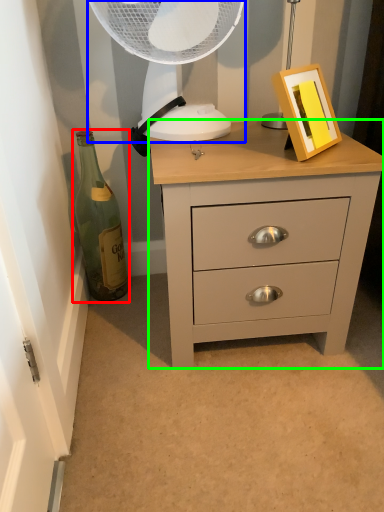
Question: Which object is the closest to the bottle (highlighted by a red box)? Choose among these: mechanical fan (highlighted by a blue box) or chest of drawers (highlighted by a green box).

Choices:
 (A) mechanical fan
 (B) chest of drawers

Answer: (A)